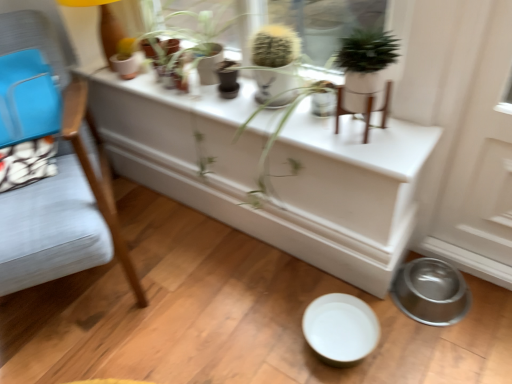
Identify the location of free point to the right of light blue fabric chair at left. The width and height of the screenshot is (512, 384). (201, 275).